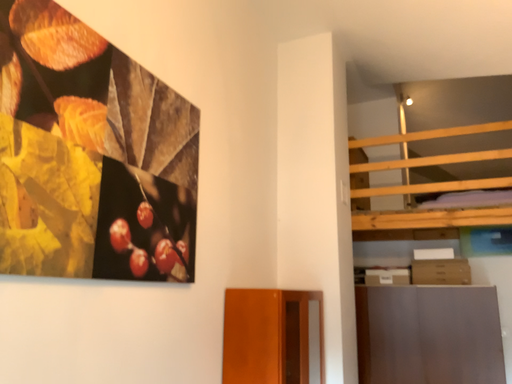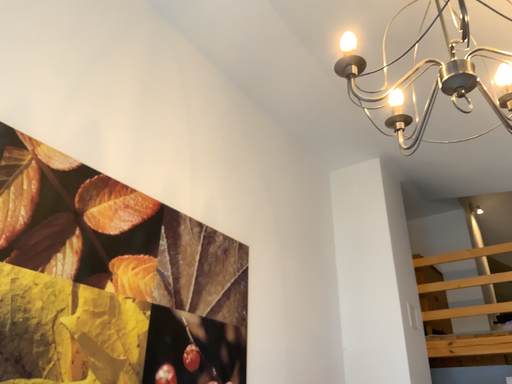
Question: How did the camera likely rotate when shooting the video?

Choices:
 (A) rotated right
 (B) rotated left

Answer: (B)